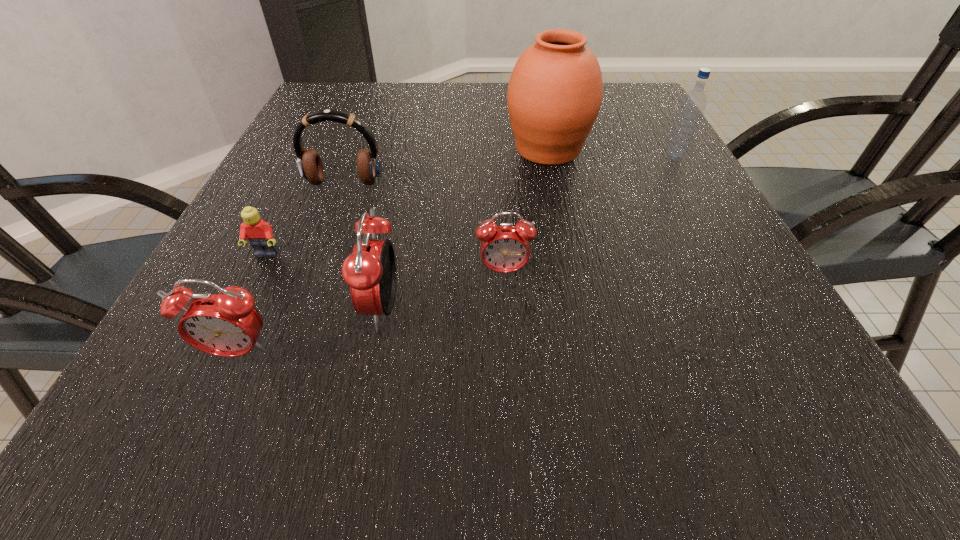
The height and width of the screenshot is (540, 960). What are the coordinates of `object that is the fourth closest to the second shortest alarm clock` in the screenshot? It's located at (309, 164).

Locate which object is the third closest to the fifth nearest object. Please provide its 2D coordinates. Your answer should be formatted as a tuple, i.e. [(x, y)], where the tuple contains the x and y coordinates of a point satisfying the conditions above.

[(554, 96)]

Find the location of a particular element. Image resolution: width=960 pixels, height=540 pixels. alarm clock object that ranks as the third closest to the Lego is located at coordinates (505, 248).

Identify which alarm clock is the closest to the second tallest alarm clock. Please provide its 2D coordinates. Your answer should be formatted as a tuple, i.e. [(x, y)], where the tuple contains the x and y coordinates of a point satisfying the conditions above.

[(370, 271)]

Locate an element on the screen. The height and width of the screenshot is (540, 960). free space that satisfies the following two spatial constraints: 1. on the face of the rightmost alarm clock; 2. on the face of the second alarm clock from right to left is located at coordinates (506, 309).

Locate an element on the screen. blank space that satisfies the following two spatial constraints: 1. on the front side of the urn; 2. on the face of the second alarm clock from left to right is located at coordinates (581, 309).

Locate an element on the screen. The image size is (960, 540). vacant region that satisfies the following two spatial constraints: 1. on the face of the second shortest object; 2. on the face of the second alarm clock from right to left is located at coordinates (506, 309).